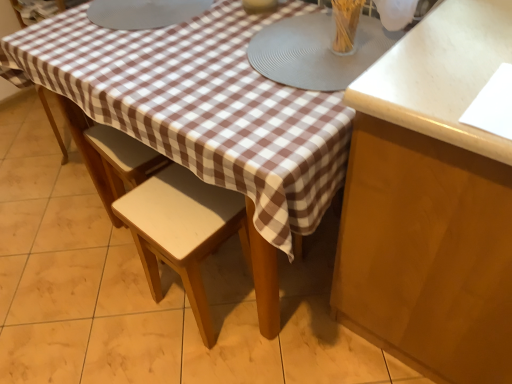
I want to click on empty space that is ontop of light beige wood stool at center (from a real-world perspective), so click(176, 209).